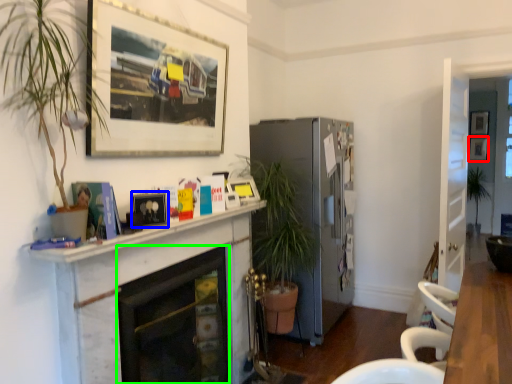
Question: Which object is the closest to the picture frame (highlighted by a red box)? Choose among these: picture frame (highlighted by a blue box) or fireplace (highlighted by a green box).

Choices:
 (A) picture frame
 (B) fireplace

Answer: (B)